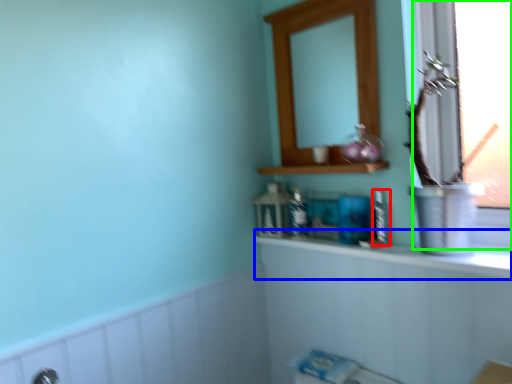
Question: Estimate the real-world distances between objects in this image. Which object is farther from toiletry (highlighted by a red box), counter top (highlighted by a blue box) or window (highlighted by a green box)?

Choices:
 (A) counter top
 (B) window

Answer: (B)